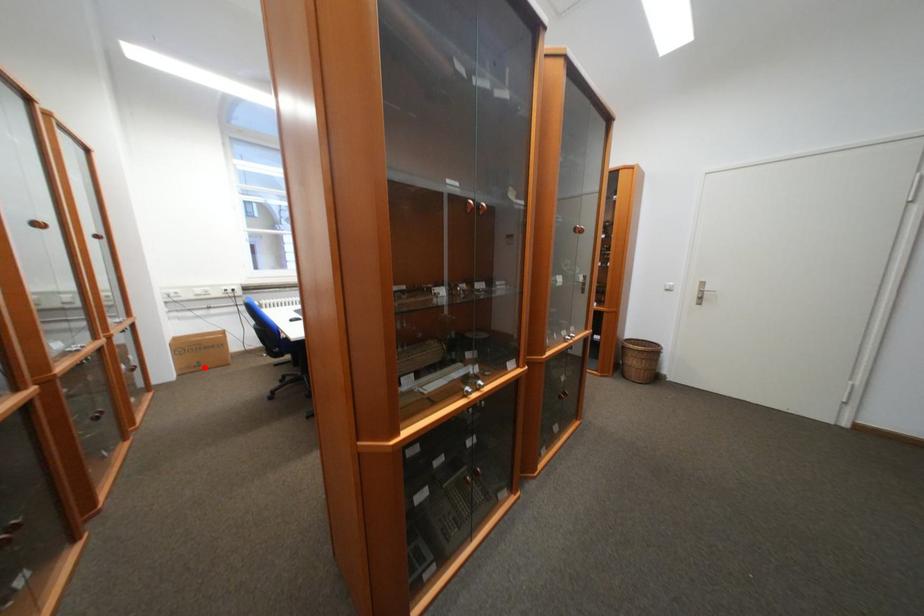
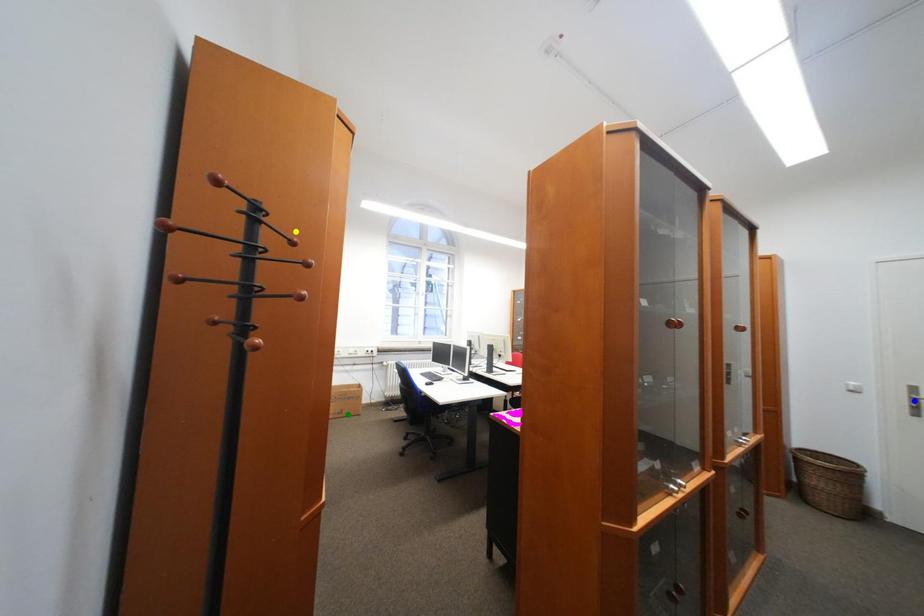
Question: I am providing you with two images of the same scene from different viewpoints. A red point is marked on the first image. You are given multiple points on the second image. Which spot in image 2 lines up with the point in image 1?

Choices:
 (A) green point
 (B) blue point
 (C) yellow point

Answer: (A)